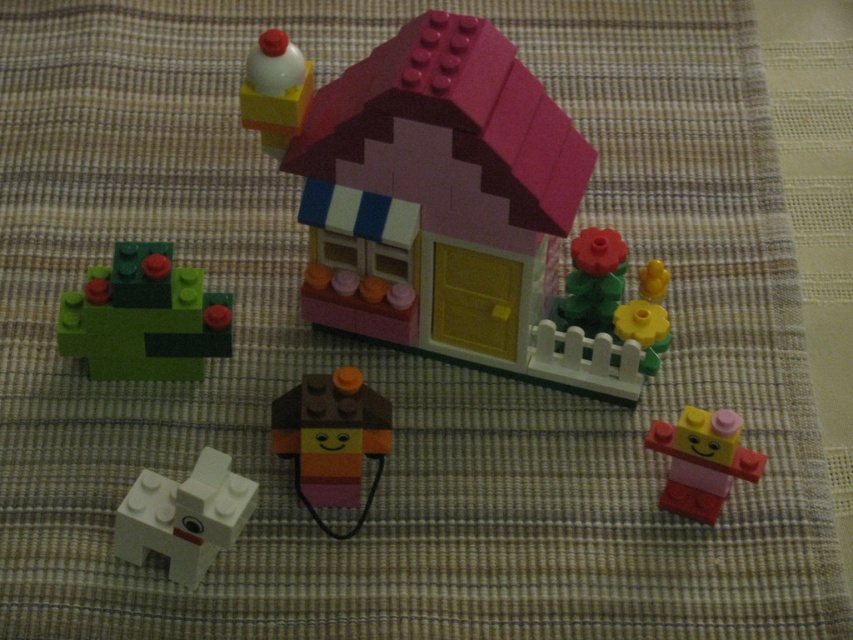
Does pink plastic house at center appear under white matte milk bottle at upper center?

Indeed, pink plastic house at center is positioned under white matte milk bottle at upper center.

From the picture: Measure the distance between pink plastic house at center and camera.

A distance of 3.57 feet exists between pink plastic house at center and camera.

Is point (386, 259) positioned behind point (277, 81)?

Yes, it is.

I want to click on pink plastic house at center, so click(450, 205).

Is green matte plant at lower left wider than smooth brown and orange face at center?

Correct, the width of green matte plant at lower left exceeds that of smooth brown and orange face at center.

Is point (189, 320) behind point (389, 445)?

Yes, point (189, 320) is behind point (389, 445).

Is point (149, 346) positioned in front of point (312, 419)?

That is False.

The height and width of the screenshot is (640, 853). I want to click on green matte plant at lower left, so click(144, 317).

Is white matte milk bottle at upper center positioned before yellow matte flower at center-right?

Yes, white matte milk bottle at upper center is closer to the viewer.

Does white matte milk bottle at upper center have a lesser height compared to yellow matte flower at center-right?

Incorrect, white matte milk bottle at upper center's height does not fall short of yellow matte flower at center-right's.

Identify the location of white matte milk bottle at upper center. The image size is (853, 640). (276, 90).